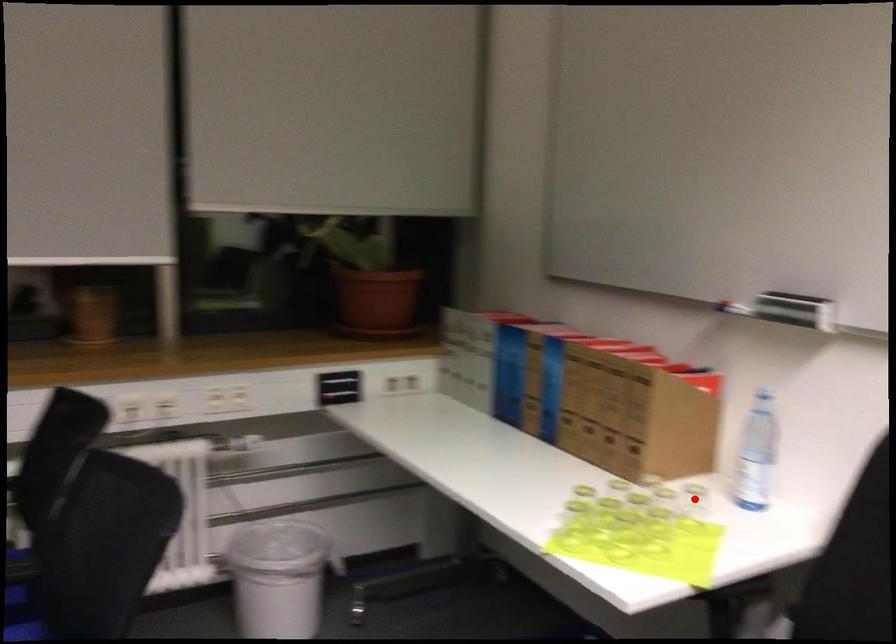
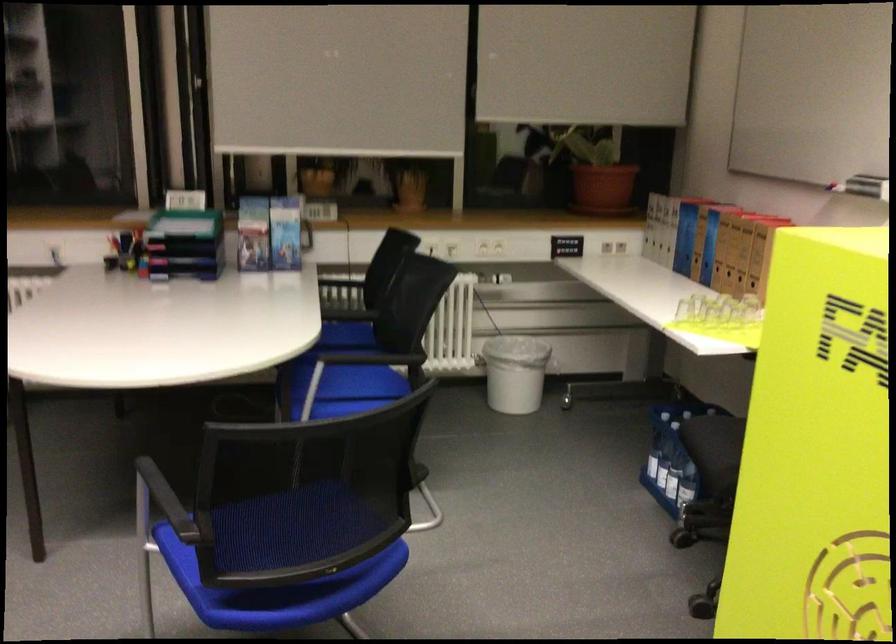
Question: I am providing you with two images of the same scene from different viewpoints. A red point is marked on the first image. Is the red point's position out of view in image 2?

Choices:
 (A) Yes
 (B) No

Answer: (A)